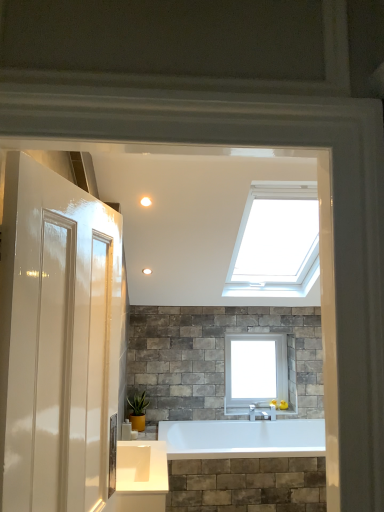
Question: Considering the relative sizes of white glass window at upper center and green matte plant at lower center in the image provided, is white glass window at upper center smaller than green matte plant at lower center?

Choices:
 (A) yes
 (B) no

Answer: (B)

Question: Are white glass window at upper center and green matte plant at lower center making contact?

Choices:
 (A) no
 (B) yes

Answer: (A)

Question: Considering the relative sizes of white glass window at upper center and green matte plant at lower center in the image provided, is white glass window at upper center bigger than green matte plant at lower center?

Choices:
 (A) no
 (B) yes

Answer: (B)

Question: Could you tell me if white glass window at upper center is facing green matte plant at lower center?

Choices:
 (A) no
 (B) yes

Answer: (A)

Question: Is white glass window at upper center taller than green matte plant at lower center?

Choices:
 (A) yes
 (B) no

Answer: (A)

Question: From a real-world perspective, is white glass window at upper center below green matte plant at lower center?

Choices:
 (A) yes
 (B) no

Answer: (B)

Question: Is matte white light fixture at upper center bigger than green matte plant at lower center?

Choices:
 (A) yes
 (B) no

Answer: (B)

Question: Does matte white light fixture at upper center have a greater width compared to green matte plant at lower center?

Choices:
 (A) no
 (B) yes

Answer: (A)

Question: Is matte white light fixture at upper center turned away from green matte plant at lower center?

Choices:
 (A) no
 (B) yes

Answer: (A)

Question: From the image's perspective, is matte white light fixture at upper center below green matte plant at lower center?

Choices:
 (A) no
 (B) yes

Answer: (A)

Question: Can you confirm if matte white light fixture at upper center is taller than green matte plant at lower center?

Choices:
 (A) yes
 (B) no

Answer: (B)

Question: From the image's perspective, is matte white light fixture at upper center on green matte plant at lower center?

Choices:
 (A) no
 (B) yes

Answer: (B)

Question: Considering the relative sizes of green matte plant at lower center and matte white light fixture at upper center in the image provided, is green matte plant at lower center smaller than matte white light fixture at upper center?

Choices:
 (A) no
 (B) yes

Answer: (A)